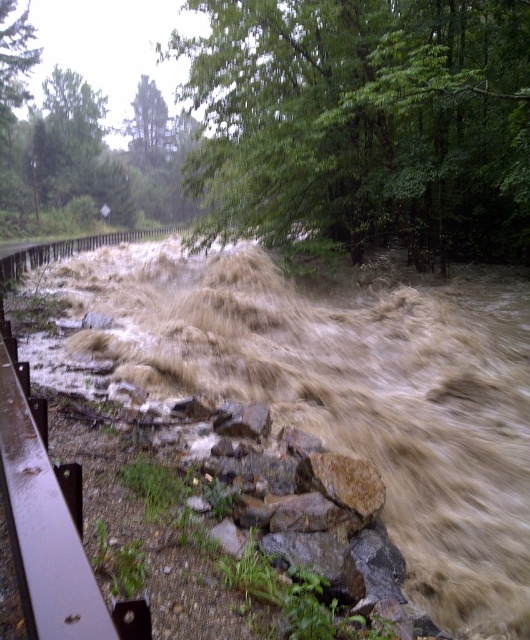
Question: Can you confirm if brown muddy water at center is wider than green leafy tree at upper center?

Choices:
 (A) yes
 (B) no

Answer: (A)

Question: Can you confirm if brown muddy water at center is positioned below green leafy tree at upper center?

Choices:
 (A) no
 (B) yes

Answer: (B)

Question: Is brown muddy water at center below rusty metal rail at lower left?

Choices:
 (A) yes
 (B) no

Answer: (B)

Question: Which point is farther to the camera?

Choices:
 (A) (16, 416)
 (B) (358, 61)
 (C) (348, 305)

Answer: (B)

Question: Which of the following is the farthest from the observer?

Choices:
 (A) pyautogui.click(x=252, y=33)
 (B) pyautogui.click(x=32, y=467)

Answer: (A)

Question: Which of the following is the closest to the observer?

Choices:
 (A) rusty metal rail at lower left
 (B) brown muddy water at center
 (C) green leafy tree at upper center

Answer: (A)